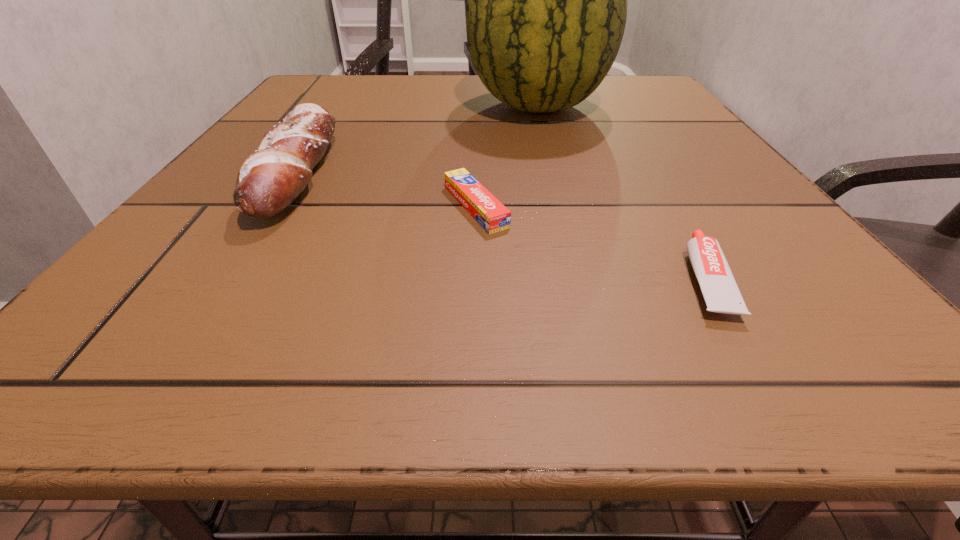
This screenshot has width=960, height=540. I want to click on blank space at the left edge, so click(162, 262).

The width and height of the screenshot is (960, 540). Find the location of `free space at the right edge`. free space at the right edge is located at coordinates (716, 146).

In the image, there is a desktop. Where is `vacant space at the far left corner`? This screenshot has width=960, height=540. vacant space at the far left corner is located at coordinates (322, 97).

What are the coordinates of `free space at the far right corner` in the screenshot? It's located at (624, 84).

Image resolution: width=960 pixels, height=540 pixels. In order to click on vacant space at the near right corner of the desktop in this screenshot , I will do `click(849, 361)`.

I want to click on free space that is in between the nearest object and the shortest object, so click(590, 243).

I want to click on free space between the watermelon and the third tallest object, so click(x=621, y=193).

Image resolution: width=960 pixels, height=540 pixels. Find the location of `vacant space that is in between the watermelon and the leftmost object`. vacant space that is in between the watermelon and the leftmost object is located at coordinates (418, 139).

This screenshot has height=540, width=960. Identify the location of unoccupied position between the watermelon and the shortest object. (507, 157).

Locate an element on the screen. unoccupied position between the shorter toothpaste and the leftmost object is located at coordinates coord(387,189).